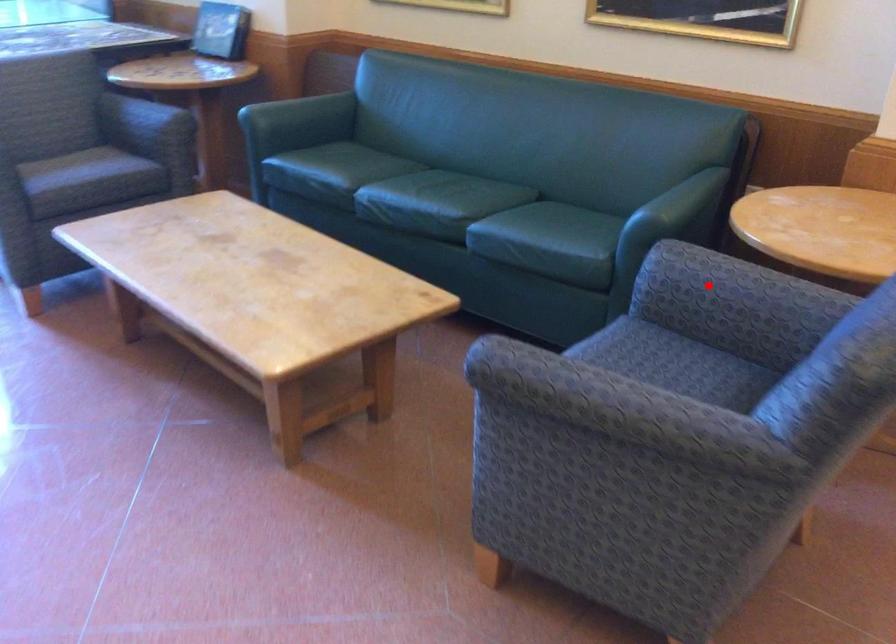
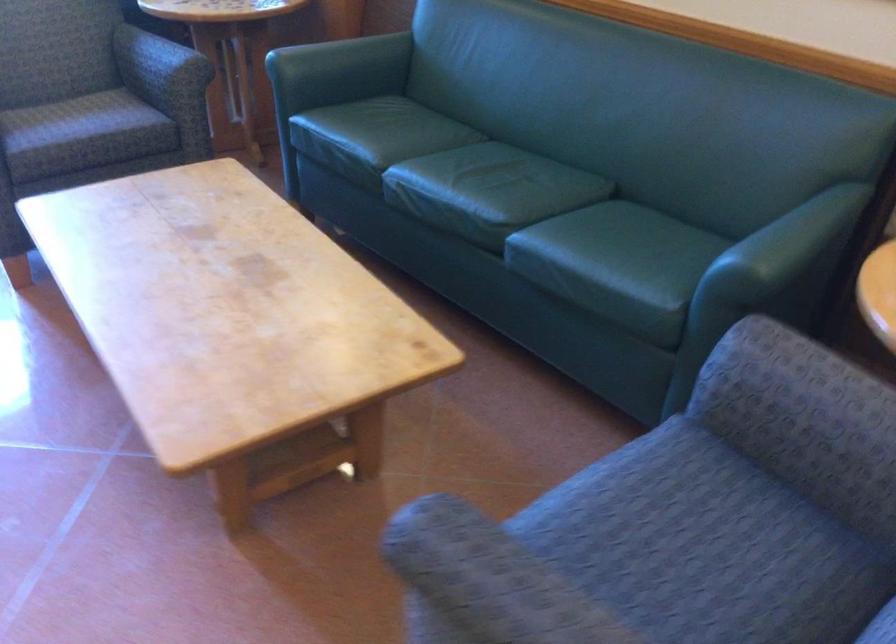
In the second image, find the point that corresponds to the highlighted location in the first image.

(796, 404)